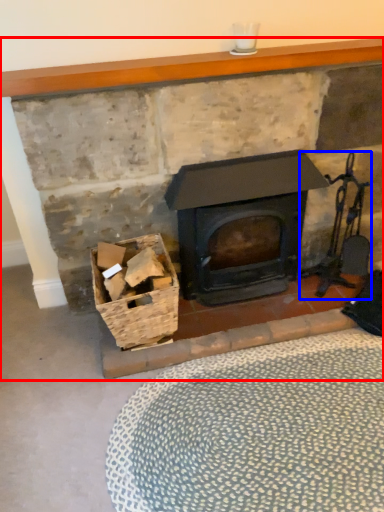
Question: Which point is further to the camera, fireplace (highlighted by a red box) or chair (highlighted by a blue box)?

Choices:
 (A) fireplace
 (B) chair

Answer: (B)